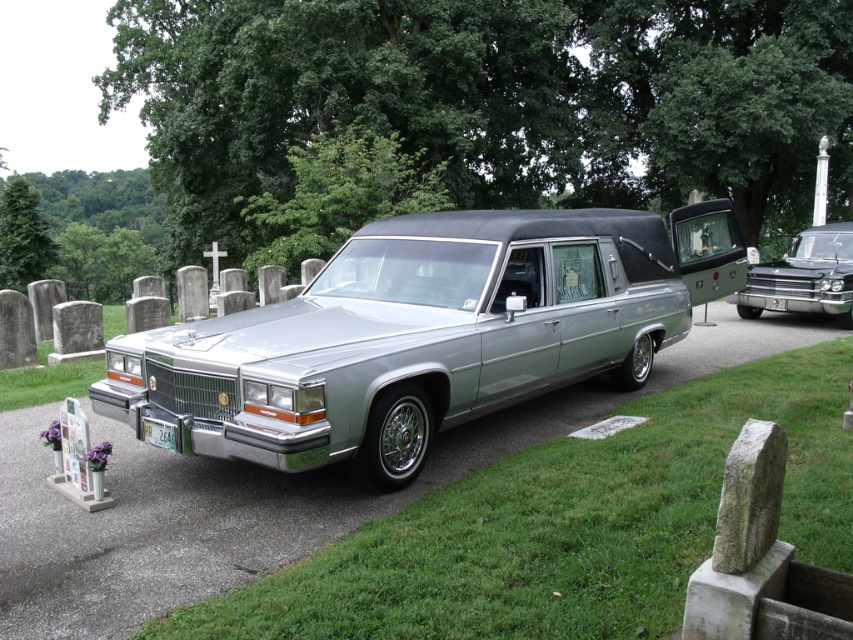
You are a photographer trying to capture the silver metallic hearse at center and the green matte license plate at lower center in a single shot. Based on their positions, which object should you adjust your camera to focus on first to ensure both are in the frame?

The silver metallic hearse at center is to the right of the green matte license plate at lower center, so you should focus on the green matte license plate at lower center first to ensure both are in the frame.

You are a visitor at the cemetery and want to take a photo of the green matte license plate at lower center without the silver metallic hearse at center blocking it. Is this possible?

The green matte license plate at lower center is behind the silver metallic hearse at center, so it is currently blocked by the hearse and cannot be photographed without moving the hearse.